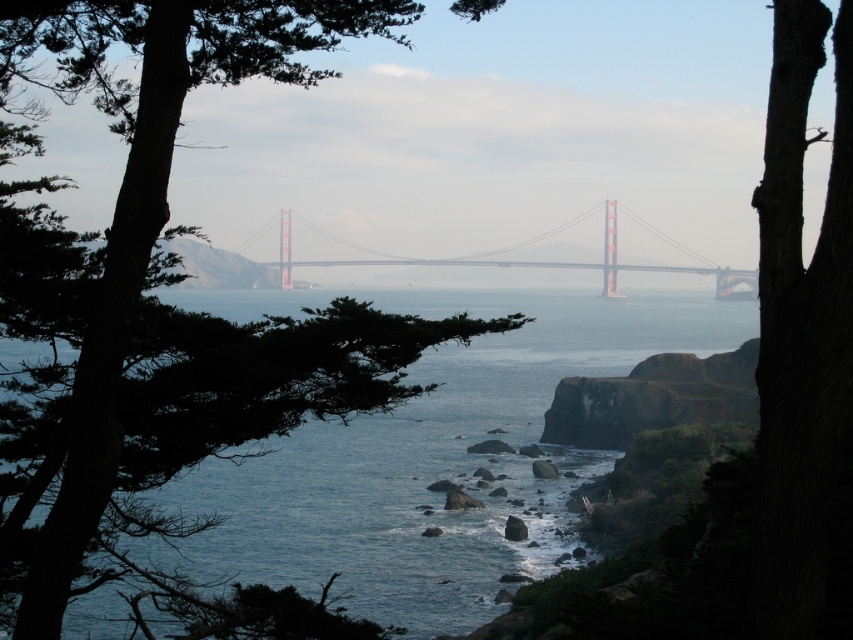
Who is taller, green leafy tree at left or blue water at center?

green leafy tree at left

Does green leafy tree at left appear under blue water at center?

Actually, green leafy tree at left is above blue water at center.

Which is behind, point (341, 403) or point (440, 426)?

The point (440, 426) is more distant.

This screenshot has height=640, width=853. Find the location of `green leafy tree at left`. green leafy tree at left is located at coordinates (155, 298).

Does blue water at center have a lesser width compared to painted steel bridge at center?

Yes.

You are a GUI agent. You are given a task and a screenshot of the screen. Output one action in this format:
    pyautogui.click(x=<x>, y=<y>)
    Task: Click on the blue water at center
    The width and height of the screenshot is (853, 640).
    Given the screenshot: What is the action you would take?
    pyautogui.click(x=425, y=452)

Find the location of a particular element. The height and width of the screenshot is (640, 853). blue water at center is located at coordinates (425, 452).

Identify the location of green leafy tree at left. The height and width of the screenshot is (640, 853). (155, 298).

Is green leafy tree at left closer to camera compared to painted steel bridge at center?

Yes, green leafy tree at left is in front of painted steel bridge at center.

Measure the distance between green leafy tree at left and camera.

green leafy tree at left is 14.80 meters from camera.

Where is `green leafy tree at left`? The width and height of the screenshot is (853, 640). green leafy tree at left is located at coordinates (155, 298).